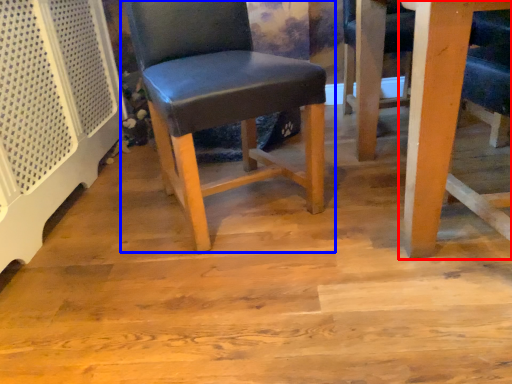
Question: Which object is further to the camera taking this photo, table (highlighted by a red box) or chair (highlighted by a blue box)?

Choices:
 (A) table
 (B) chair

Answer: (B)